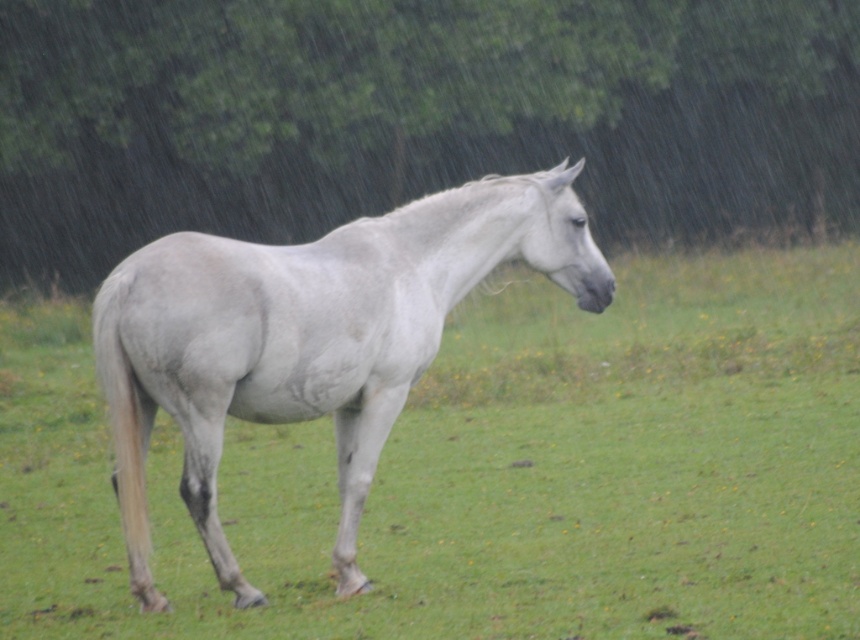
Which of these two, green leafy tree at upper center or gray matte horse at center, stands shorter?

gray matte horse at center is shorter.

What do you see at coordinates (415, 116) in the screenshot? I see `green leafy tree at upper center` at bounding box center [415, 116].

This screenshot has width=860, height=640. I want to click on green leafy tree at upper center, so click(415, 116).